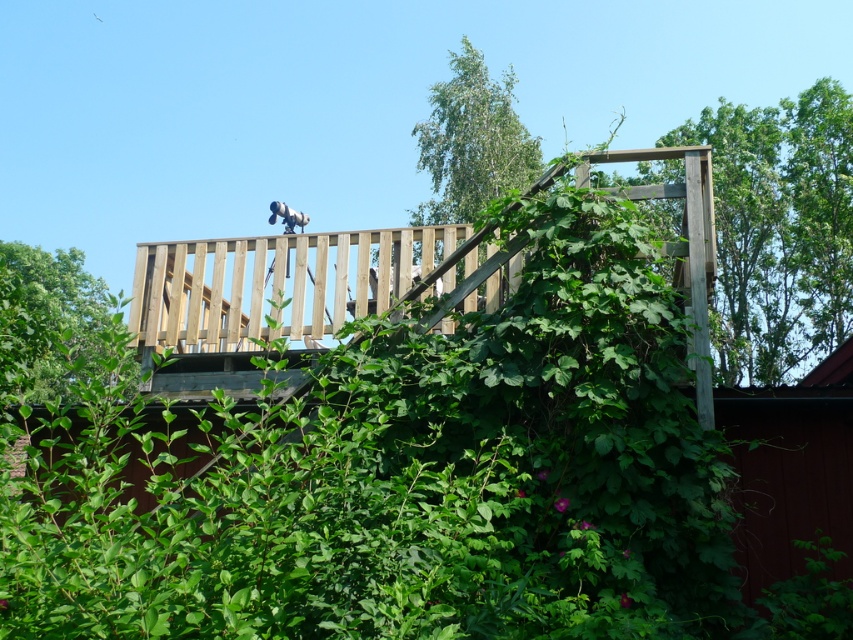
Does point (309, 241) come behind point (730, 212)?

That is False.

Between point (316, 342) and point (758, 355), which one is positioned in front?

Point (316, 342)

Image resolution: width=853 pixels, height=640 pixels. What are the coordinates of `wooden at upper center` in the screenshot? It's located at (289, 294).

Is point (277, 275) closer to viewer compared to point (33, 340)?

Yes, it is.

Which is in front, point (207, 394) or point (39, 285)?

Point (207, 394) is more forward.

You are a GUI agent. You are given a task and a screenshot of the screen. Output one action in this format:
    pyautogui.click(x=<x>, y=<y>)
    Task: Click on the wooden at upper center
    The image size is (853, 640).
    Given the screenshot: What is the action you would take?
    pyautogui.click(x=289, y=294)

Is the position of green leafy tree at upper right more distant than that of green leafy tree at upper center?

Yes, it is.

Does point (804, 113) lie in front of point (10, 344)?

That is False.

Locate an element on the screen. green leafy tree at upper right is located at coordinates (778, 230).